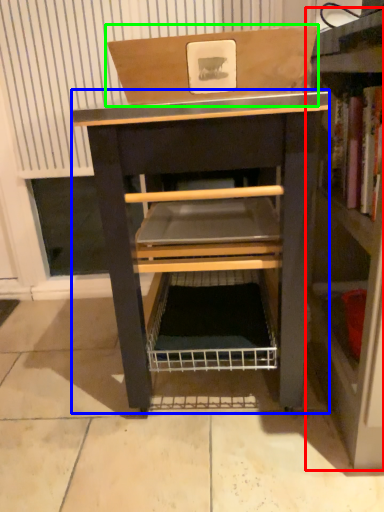
Question: Based on their relative distances, which object is nearer to shelf (highlighted by a red box)? Choose from vanity (highlighted by a blue box) and cardboard box (highlighted by a green box).

Choices:
 (A) vanity
 (B) cardboard box

Answer: (A)